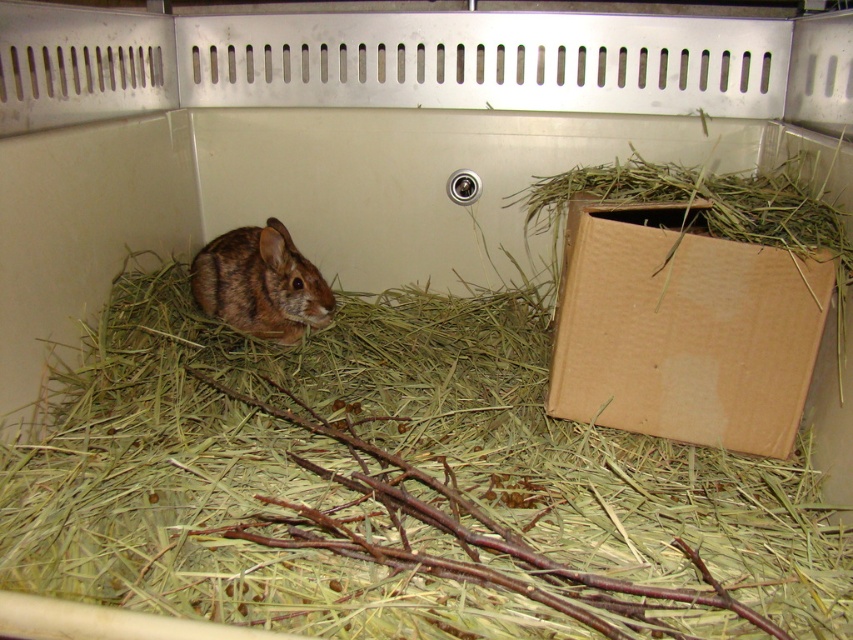
You are a small animal keeper who needs to place a new feeding bowl in the enclosure. The bowl requires a space of at least 12 inches from the brown cardboard box at right and the brown furry rabbit at center to avoid disturbance. Is there enough space between them to place the bowl?

The brown cardboard box at right is 24.79 inches away from the brown furry rabbit at center. Since the required minimum distance is 12 inches, the 24.79 inches between them is sufficient to place the feeding bowl without disturbing either the box or the rabbit.